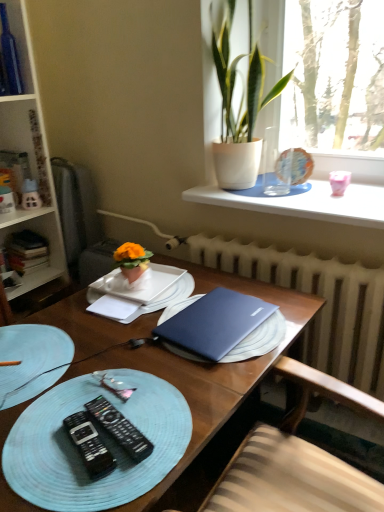
Where is `vacant region to the right of blue woven placemat at lower left, arranged as the second tableware when viewed from the top`? vacant region to the right of blue woven placemat at lower left, arranged as the second tableware when viewed from the top is located at coordinates 125,371.